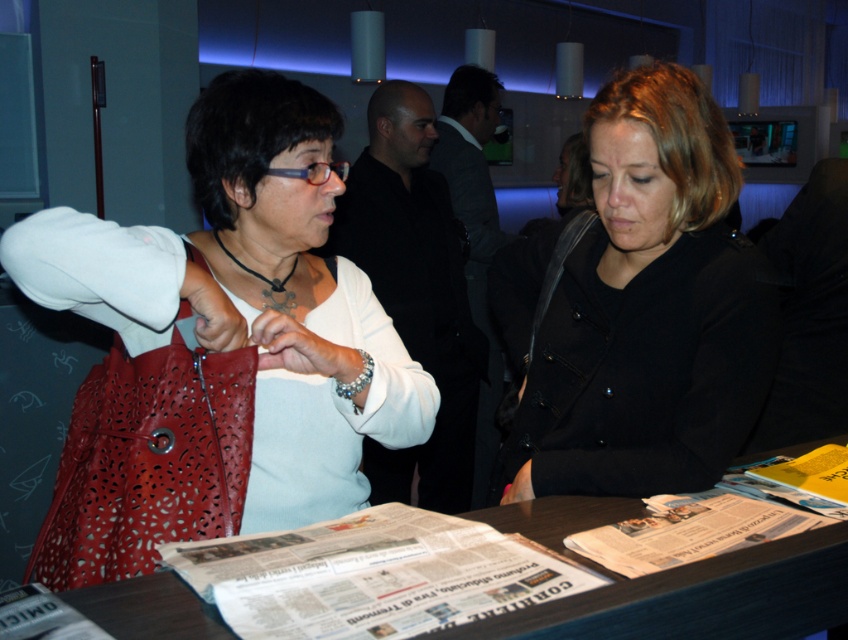
Between matte leather bag at left and black matte coat at center, which one is positioned higher?

black matte coat at center is above.

Is point (90, 560) farther from camera compared to point (656, 113)?

That is False.

Measure the distance between point (315, 129) and camera.

A distance of 3.72 feet exists between point (315, 129) and camera.

At what (x,y) coordinates should I click in order to perform the action: click on matte leather bag at left. Please return your answer as a coordinate pair (x, y). This screenshot has height=640, width=848. Looking at the image, I should click on tap(219, 348).

Between point (62, 262) and point (533, 557), which one is positioned behind?

The point (62, 262) is more distant.

Between matte leather bag at left and white glossy newspaper at center, which one appears on the left side from the viewer's perspective?

matte leather bag at left

Find the location of `matte leather bag at left`. matte leather bag at left is located at coordinates (219, 348).

This screenshot has width=848, height=640. I want to click on matte leather bag at left, so tap(219, 348).

Can you confirm if black matte coat at center is positioned above wooden table at center?

Indeed, black matte coat at center is positioned over wooden table at center.

Which is behind, point (621, 161) or point (165, 637)?

Point (621, 161)

Who is more forward, (x=544, y=385) or (x=617, y=593)?

Point (x=617, y=593) is in front.

The image size is (848, 640). Identify the location of black matte coat at center. (648, 308).